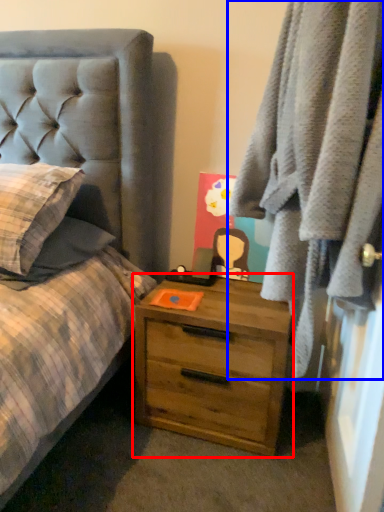
Question: Which object appears closest to the camera in this image, chest of drawers (highlighted by a red box) or clothing (highlighted by a blue box)?

Choices:
 (A) chest of drawers
 (B) clothing

Answer: (B)